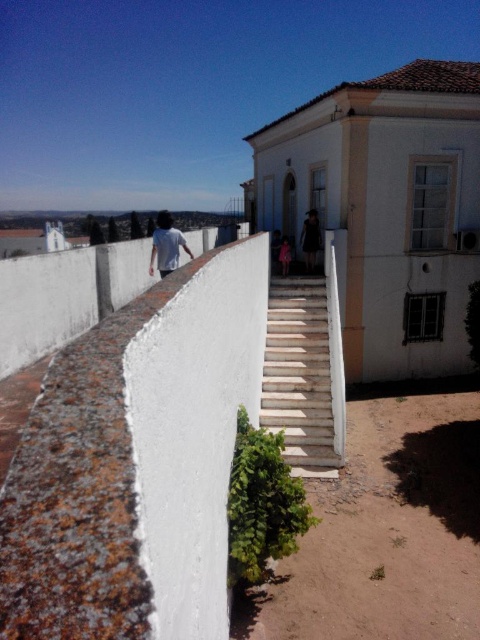
You are a photographer planning to take a portrait of two people wearing the white cotton shirt at center and the black fabric dress at center. You want to ensure both outfits are clearly visible in the photo. Which outfit will require more space in the frame due to its width?

The white cotton shirt at center has a greater width than the black fabric dress at center, so it will require more space in the frame.

You are standing at the entrance of the white building with a terracotta roof and see both the white concrete stairs at center and the pink fabric dress at center. Which object is closer to you?

The white concrete stairs at center is in front of the pink fabric dress at center, so the white concrete stairs at center is closer to you.

You are a photographer planning to take a photo of the white cotton shirt at center and the pink fabric dress at center. Based on their positions, which one should you focus on first to ensure both are in sharp focus?

The white cotton shirt at center should be focused on first because it is above the pink fabric dress at center, so adjusting focus starting from the higher object ensures both are in sharp focus.